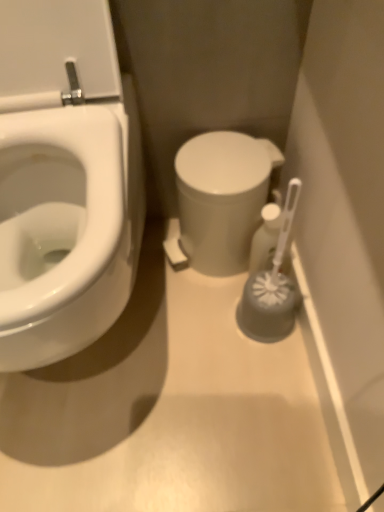
What do you see at coordinates (61, 233) in the screenshot? I see `white glossy bidet at left` at bounding box center [61, 233].

This screenshot has width=384, height=512. In order to click on gray rubber brush at right in this screenshot , I will do `click(272, 287)`.

I want to click on white glossy bidet at left, so click(61, 233).

Is white plastic toilet brush at right at the back of white glossy toilet at center?

That's not correct — white glossy toilet at center is not looking away from white plastic toilet brush at right.

Visually, is white glossy toilet at center positioned to the left or to the right of white plastic toilet brush at right?

Based on their positions, white glossy toilet at center is located to the left of white plastic toilet brush at right.

Considering the sizes of objects white glossy toilet at center and white plastic toilet brush at right in the image provided, who is smaller, white glossy toilet at center or white plastic toilet brush at right?

Smaller between the two is white plastic toilet brush at right.

Is white glossy toilet at center in front of white plastic toilet brush at right?

Yes, white glossy toilet at center is closer to the camera.

Considering the positions of objects gray rubber brush at right and white glossy toilet at center in the image provided, who is behind, gray rubber brush at right or white glossy toilet at center?

white glossy toilet at center is further from the camera.

Considering the points (261, 326) and (183, 176), which point is behind, point (261, 326) or point (183, 176)?

The point (261, 326) is more distant.

Can you confirm if gray rubber brush at right is smaller than white glossy toilet at center?

Yes.

Which is correct: gray rubber brush at right is inside white glossy toilet at center, or outside of it?

gray rubber brush at right is located beyond the bounds of white glossy toilet at center.

Looking at this image, relative to white plastic toilet brush at right, is gray rubber brush at right in front or behind?

Clearly, gray rubber brush at right is in front of white plastic toilet brush at right.

Considering the relative sizes of gray rubber brush at right and white plastic toilet brush at right in the image provided, is gray rubber brush at right bigger than white plastic toilet brush at right?

→ Correct, gray rubber brush at right is larger in size than white plastic toilet brush at right.

Which of these two, gray rubber brush at right or white plastic toilet brush at right, is wider?

gray rubber brush at right.

Which is more distant, (276, 304) or (260, 249)?

Positioned behind is point (260, 249).

Locate an element on the screen. Image resolution: width=384 pixels, height=512 pixels. toiletry that appears on the right of gray rubber brush at right is located at coordinates (265, 238).

Consider the image. From the image's perspective, is white plastic toilet brush at right on top of gray rubber brush at right?

Correct, white plastic toilet brush at right appears higher than gray rubber brush at right in the image.

How many degrees apart are the facing directions of white plastic toilet brush at right and gray rubber brush at right?

There is a 0.000554-degree angle between the facing directions of white plastic toilet brush at right and gray rubber brush at right.

Based on the photo, measure the distance from white plastic toilet brush at right to gray rubber brush at right.

6.45 centimeters.

Is white glossy bidet at left not close to white glossy toilet at center?

white glossy bidet at left is near white glossy toilet at center, not far away.

From a real-world perspective, is white glossy bidet at left below white glossy toilet at center?

No, from a real-world perspective, white glossy bidet at left is not below white glossy toilet at center.

Which is more to the left, white glossy bidet at left or white glossy toilet at center?

Positioned to the left is white glossy bidet at left.

Would you say white glossy bidet at left is inside or outside white glossy toilet at center?

white glossy bidet at left exists outside the volume of white glossy toilet at center.

Is white glossy bidet at left taller than white plastic toilet brush at right?

Correct, white glossy bidet at left is much taller as white plastic toilet brush at right.

From a real-world perspective, is white glossy bidet at left positioned above or below white plastic toilet brush at right?

In terms of real-world spatial position, white glossy bidet at left is above white plastic toilet brush at right.

Considering the positions of points (30, 351) and (270, 267), is point (30, 351) closer to camera compared to point (270, 267)?

Yes, it is.

Which of these two, white glossy bidet at left or white plastic toilet brush at right, is thinner?

white plastic toilet brush at right is thinner.

Locate an element on the screen. The image size is (384, 512). toiletry below the white glossy toilet at center (from the image's perspective) is located at coordinates (265, 238).

Does point (273, 245) lie in front of point (223, 265)?

Yes.

From the image's perspective, which one is positioned higher, white plastic toilet brush at right or white glossy toilet at center?

white glossy toilet at center appears higher in the image.

Is white plastic toilet brush at right positioned with its back to white glossy toilet at center?

That's right, white plastic toilet brush at right is facing away from white glossy toilet at center.

I want to click on porcelain that appears in front of the white plastic toilet brush at right, so point(222,197).

Identify the location of porcelain below the gray rubber brush at right (from a real-world perspective). (222, 197).

Looking at the image, which one is located closer to white plastic toilet brush at right, gray rubber brush at right or white glossy bidet at left?

Based on the image, gray rubber brush at right appears to be nearer to white plastic toilet brush at right.

From the image, which object appears to be farther from white glossy bidet at left, white glossy toilet at center or white plastic toilet brush at right?

white plastic toilet brush at right lies further to white glossy bidet at left than the other object.

Based on their spatial positions, is white glossy toilet at center or white glossy bidet at left closer to gray rubber brush at right?

white glossy toilet at center lies closer to gray rubber brush at right than the other object.

From the image, which object appears to be nearer to white glossy toilet at center, gray rubber brush at right or white glossy bidet at left?

Among the two, gray rubber brush at right is located nearer to white glossy toilet at center.

Considering their positions, is gray rubber brush at right positioned further to white glossy bidet at left than white glossy toilet at center?

gray rubber brush at right.

Based on their spatial positions, is white glossy toilet at center or gray rubber brush at right closer to white glossy bidet at left?

white glossy toilet at center is closer to white glossy bidet at left.

Based on their spatial positions, is white glossy toilet at center or gray rubber brush at right further from white plastic toilet brush at right?

white glossy toilet at center.

Estimate the real-world distances between objects in this image. Which object is further from white plastic toilet brush at right, white glossy toilet at center or white glossy bidet at left?

Among the two, white glossy bidet at left is located further to white plastic toilet brush at right.

I want to click on brush positioned between white glossy bidet at left and white glossy toilet at center from near to far, so click(272, 287).

You are a GUI agent. You are given a task and a screenshot of the screen. Output one action in this format:
    pyautogui.click(x=<x>, y=<y>)
    Task: Click on the porcelain between gray rubber brush at right and white plastic toilet brush at right from front to back
    This screenshot has height=512, width=384.
    Given the screenshot: What is the action you would take?
    pyautogui.click(x=222, y=197)

Identify the location of porcelain located between white glossy bidet at left and white plastic toilet brush at right in the depth direction. [222, 197].

Find the location of a particular element. brush between white glossy bidet at left and white plastic toilet brush at right along the z-axis is located at coordinates (272, 287).